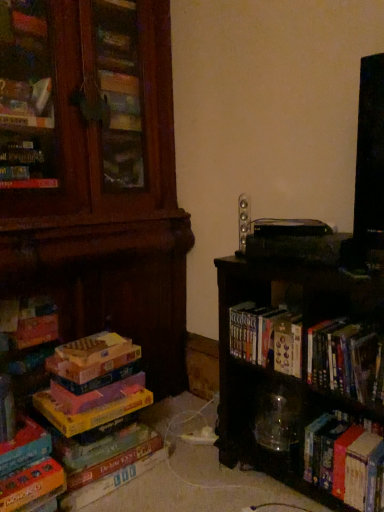
This screenshot has width=384, height=512. In order to click on vacant space in front of satin silver speaker at upper center in this screenshot , I will do `click(252, 263)`.